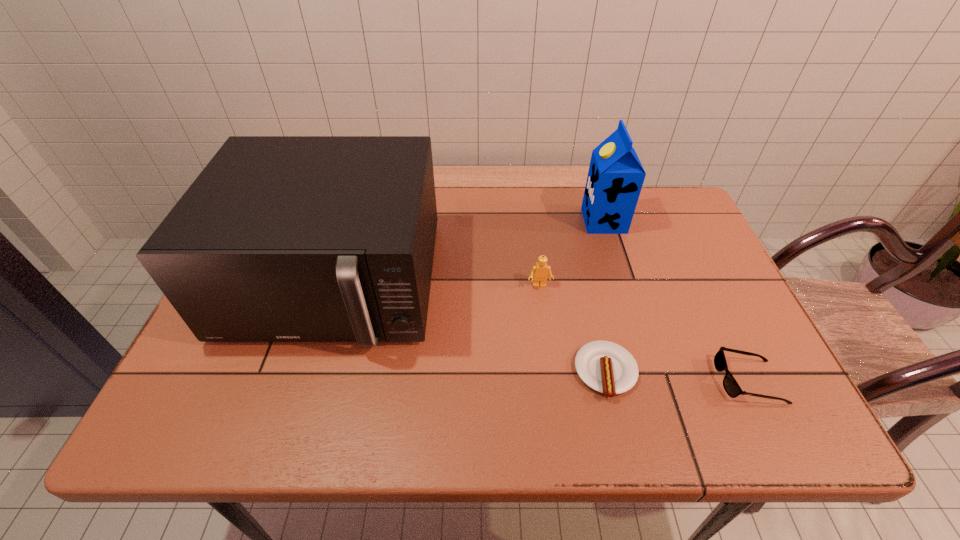
At what (x,y) coordinates should I click in order to perform the action: click on free space between the leftmost object and the carton. Please return your answer as a coordinate pair (x, y). Looking at the image, I should click on (468, 252).

I want to click on free space between the sunglasses and the sausage, so click(677, 376).

Find the location of a particular element. vacant space that is in between the rightmost object and the microwave oven is located at coordinates (541, 332).

The image size is (960, 540). I want to click on unoccupied position between the leftmost object and the third tallest object, so click(437, 284).

The width and height of the screenshot is (960, 540). I want to click on vacant area that lies between the carton and the shortest object, so click(x=605, y=296).

I want to click on vacant space that is in between the rightmost object and the third shortest object, so click(644, 333).

The width and height of the screenshot is (960, 540). In order to click on vacant space that is in between the shortest object and the carton in this screenshot , I will do `click(605, 296)`.

Locate an element on the screen. The image size is (960, 540). empty location between the Lego and the carton is located at coordinates (571, 253).

The height and width of the screenshot is (540, 960). In order to click on free spot between the third tallest object and the carton in this screenshot , I will do click(x=571, y=253).

The image size is (960, 540). Find the location of `vacant space that's between the fourth object from right to left and the carton`. vacant space that's between the fourth object from right to left and the carton is located at coordinates pos(571,253).